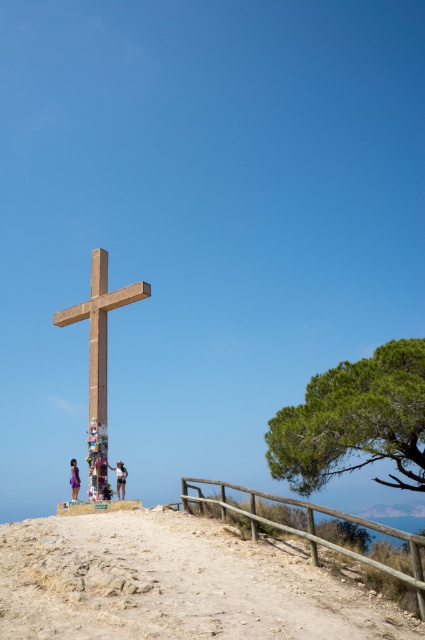
Question: Does dirt path at center appear on the left side of wooden cross at center?

Choices:
 (A) yes
 (B) no

Answer: (B)

Question: Which point is farther from the camera taking this photo?

Choices:
 (A) (104, 262)
 (B) (122, 477)

Answer: (A)

Question: In this image, where is wooden cross at center located relative to light brown wooden cross at center?

Choices:
 (A) left
 (B) right

Answer: (B)

Question: Which point is farther to the camera?

Choices:
 (A) (130, 548)
 (B) (119, 468)

Answer: (B)

Question: Estimate the real-world distances between objects in this image. Which object is farther from the light brown wooden cross at center?

Choices:
 (A) light blue denim shorts at center
 (B) dirt path at center

Answer: (B)

Question: Can you confirm if dirt path at center is positioned above wooden cross at center?

Choices:
 (A) no
 (B) yes

Answer: (A)